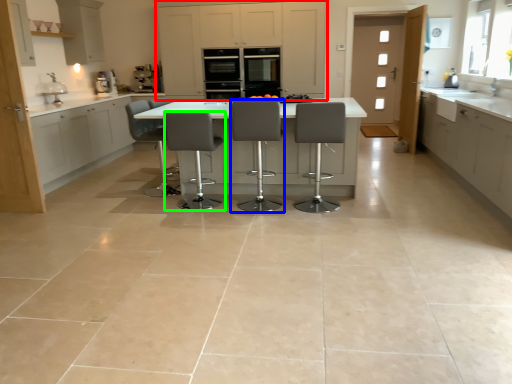
Question: Based on their relative distances, which object is nearer to cabinetry (highlighted by a red box)? Choose from chair (highlighted by a blue box) and chair (highlighted by a green box).

Choices:
 (A) chair
 (B) chair

Answer: (B)